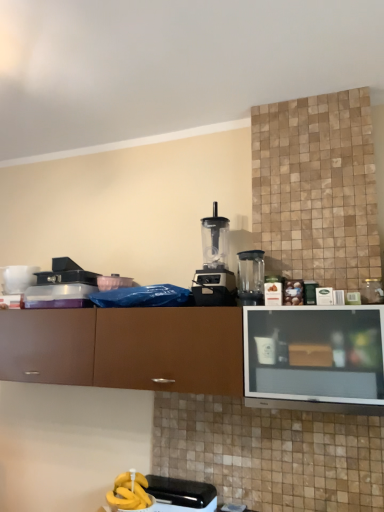
Question: Looking at their shapes, would you say black plastic toaster at lower center, marked as the second appliance in a top-to-bottom arrangement, is wider or thinner than black plastic blender at center, which ranks as the 2th kitchen appliance in right-to-left order?

Choices:
 (A) thin
 (B) wide

Answer: (A)

Question: From the image's perspective, is black plastic toaster at lower center, the 1th appliance in the front-to-back sequence, located above or below black plastic blender at center, which ranks as the 2th kitchen appliance in right-to-left order?

Choices:
 (A) below
 (B) above

Answer: (A)

Question: Which is nearer to the black plastic blender at center, the 1th kitchen appliance in the left-to-right sequence?

Choices:
 (A) black plastic toaster at lower center, the 1th appliance positioned from the right
 (B) white glossy mug at upper left, acting as the 1th appliance starting from the back
 (C) brown matte cabinet at center
 (D) transparent plastic blender at center, which is counted as the second kitchen appliance, starting from the left

Answer: (D)

Question: Which of these objects is positioned closest to the transparent plastic blender at center, which is counted as the second kitchen appliance, starting from the left?

Choices:
 (A) brown matte cabinet at center
 (B) white glossy mug at upper left, which is the 2th appliance in right-to-left order
 (C) black plastic toaster at lower center, which is counted as the 2th appliance, starting from the back
 (D) black plastic blender at center, which ranks as the 2th kitchen appliance in right-to-left order

Answer: (D)